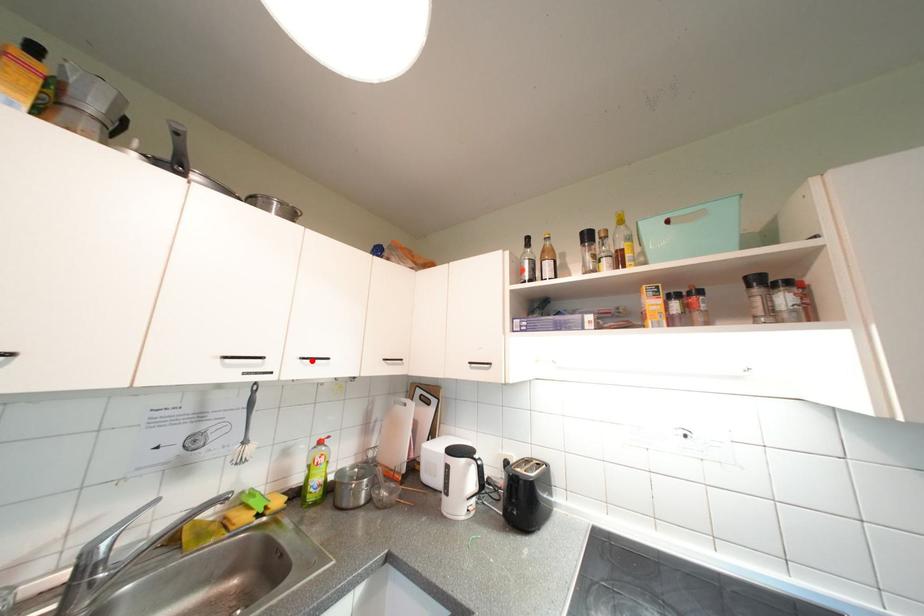
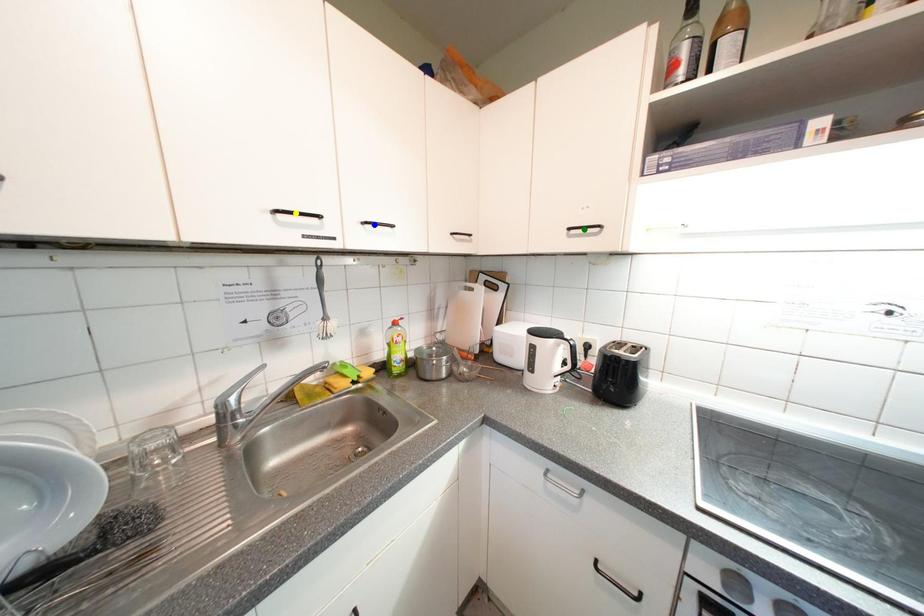
Question: I am providing you with two images of the same scene from different viewpoints. A red point is marked on the first image. You are given multiple points on the second image. Which spot in image 2 lines up with the point in image 1?

Choices:
 (A) green point
 (B) blue point
 (C) yellow point

Answer: (B)